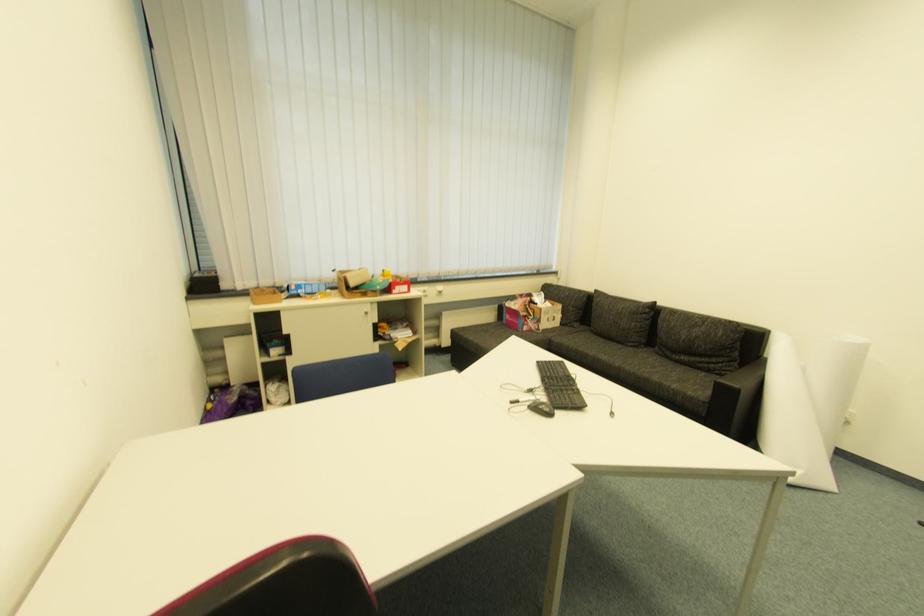
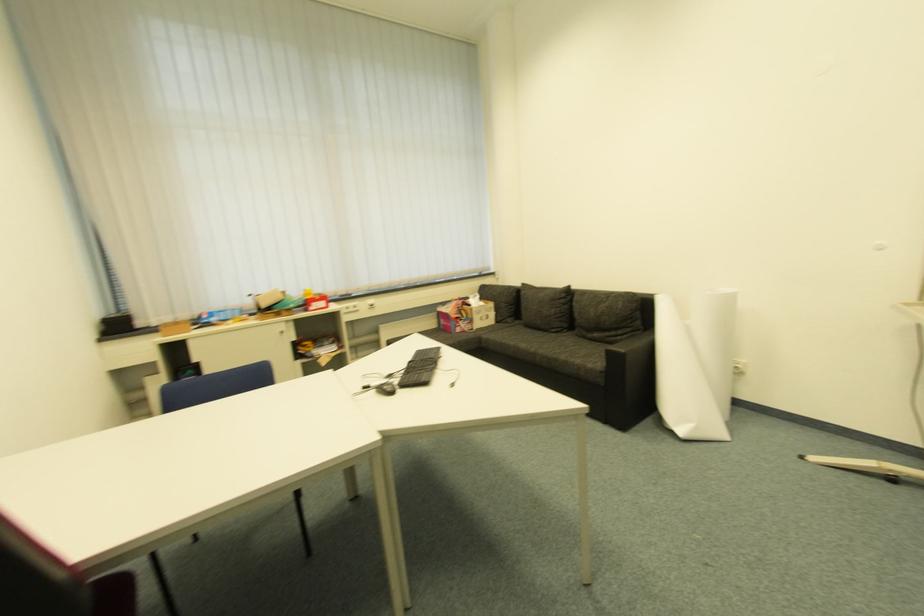
Question: How did the camera likely rotate?

Choices:
 (A) Left
 (B) Right
 (C) Up
 (D) Down

Answer: (C)